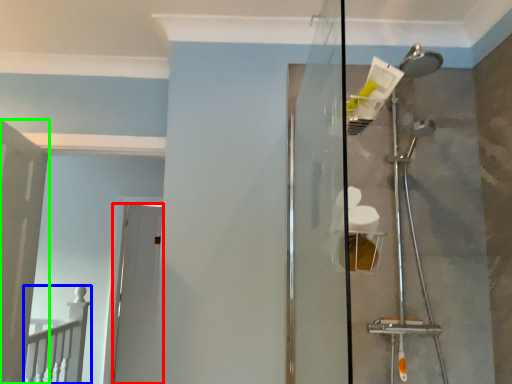
Question: Which object is positioned closest to door (highlighted by a red box)? Select from rail (highlighted by a blue box) and door (highlighted by a green box).

Choices:
 (A) rail
 (B) door

Answer: (A)